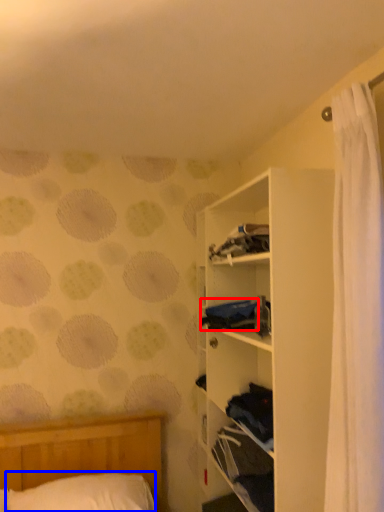
Question: Among these objects, which one is nearest to the camera, clothing (highlighted by a red box) or pillow (highlighted by a blue box)?

Choices:
 (A) clothing
 (B) pillow

Answer: (B)